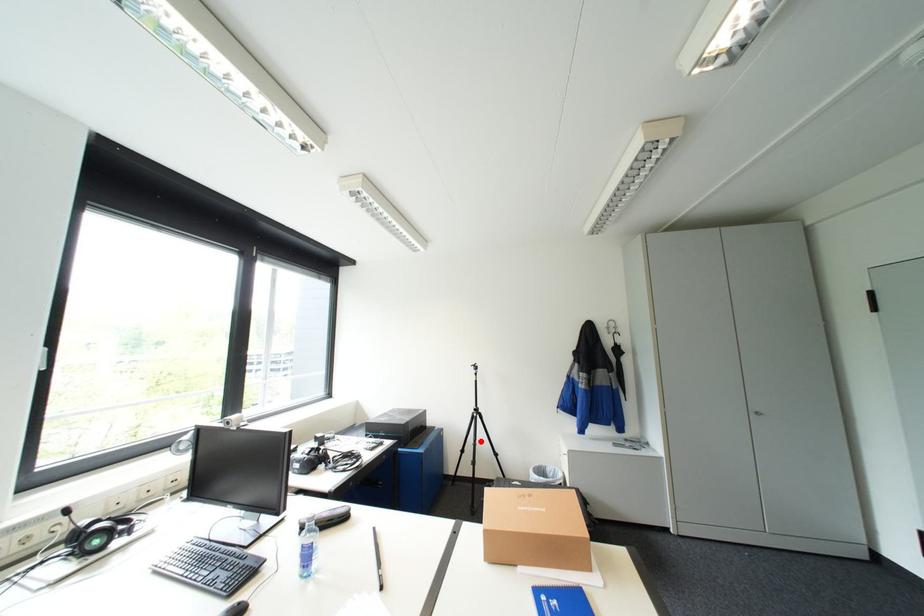
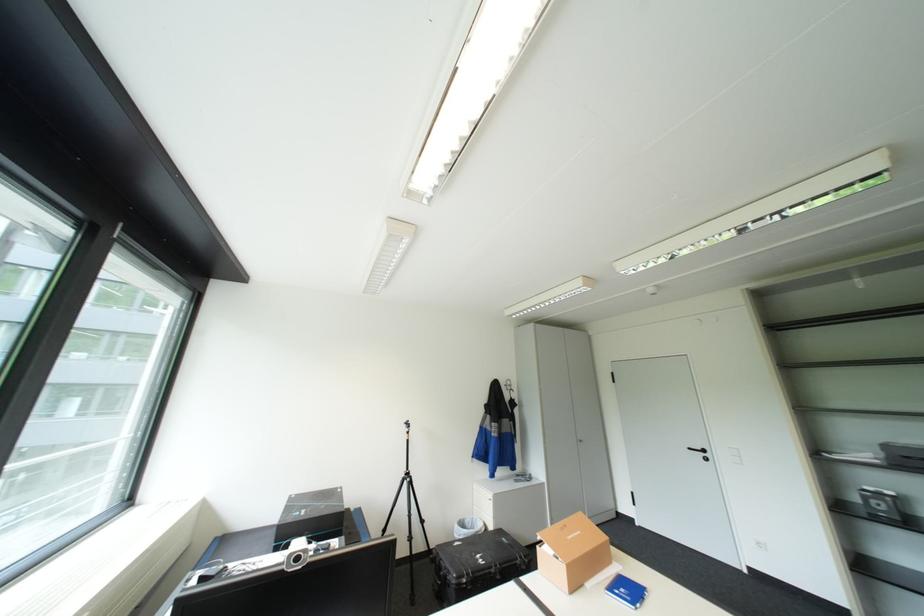
In the second image, find the point that corresponds to the highlighted location in the first image.

(416, 512)